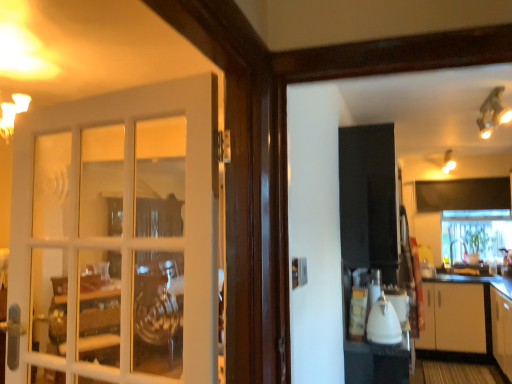
Question: Considering their positions, is clear glass window at center located in front of or behind white glossy countertop at right?

Choices:
 (A) behind
 (B) front

Answer: (A)

Question: Considering the positions of point (470, 241) and point (467, 281), is point (470, 241) closer or farther from the camera than point (467, 281)?

Choices:
 (A) closer
 (B) farther

Answer: (B)

Question: Which object is positioned farthest from the white glossy kettle at center?

Choices:
 (A) white glass door at left
 (B) white glossy cabinet at lower right
 (C) clear glass window at center
 (D) white glossy countertop at right

Answer: (C)

Question: Which is nearer to the white glass door at left?

Choices:
 (A) clear glass window at center
 (B) white glossy kettle at center
 (C) white glossy countertop at right
 (D) white glossy cabinet at lower right

Answer: (B)